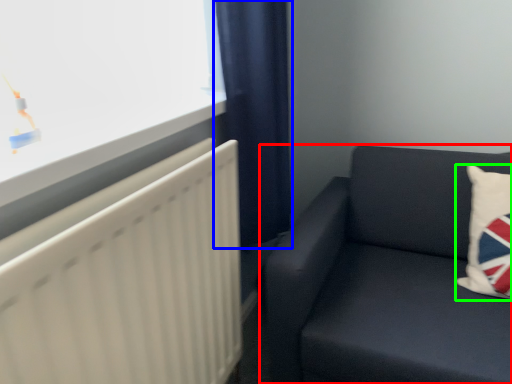
Question: Which object is the farthest from studio couch (highlighted by a red box)? Choose among these: curtain (highlighted by a blue box) or pillow (highlighted by a green box).

Choices:
 (A) curtain
 (B) pillow

Answer: (A)